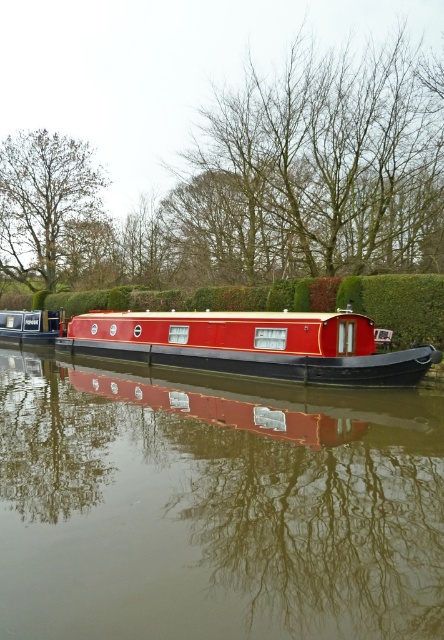
Between glossy red boat at center and brown leafless trees at upper center, which one has more height?

brown leafless trees at upper center

Where is `glossy red boat at center`? This screenshot has height=640, width=444. glossy red boat at center is located at coordinates (214, 506).

Find the location of `glossy red boat at center`. glossy red boat at center is located at coordinates (214, 506).

Which of these two, brown leafless trees at upper center or brown leafy tree at upper left, stands taller?

Standing taller between the two is brown leafless trees at upper center.

Describe the element at coordinates (213, 150) in the screenshot. I see `brown leafless trees at upper center` at that location.

Where is `brown leafless trees at upper center`? This screenshot has height=640, width=444. brown leafless trees at upper center is located at coordinates (213, 150).

Who is more forward, (x=51, y=481) or (x=102, y=337)?

Point (x=51, y=481) is in front.

Find the location of a particular element. The height and width of the screenshot is (640, 444). glossy red boat at center is located at coordinates (214, 506).